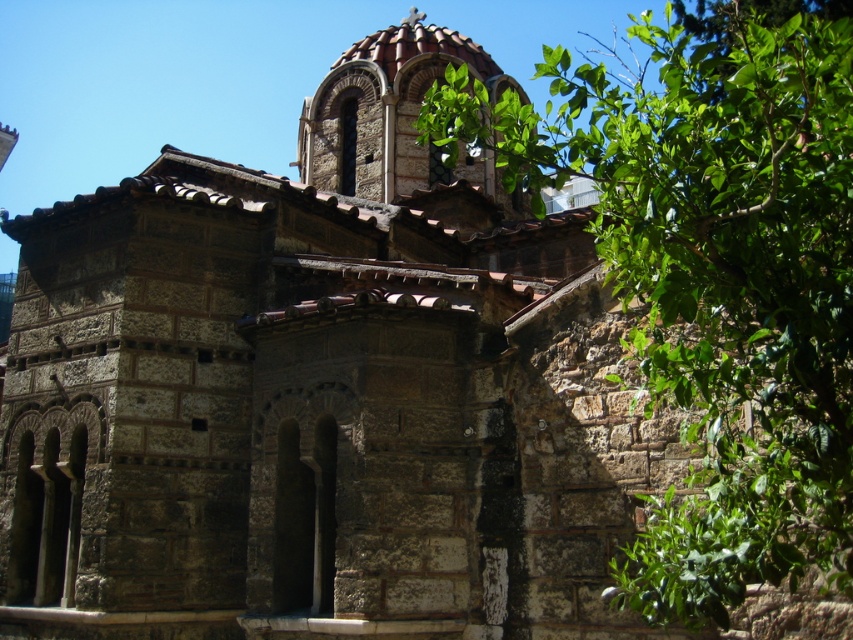
Can you confirm if green leafy tree at upper right is thinner than brown stone dome at upper center?

In fact, green leafy tree at upper right might be wider than brown stone dome at upper center.

Can you confirm if green leafy tree at upper right is smaller than brown stone dome at upper center?

Actually, green leafy tree at upper right might be larger than brown stone dome at upper center.

This screenshot has height=640, width=853. Describe the element at coordinates (712, 276) in the screenshot. I see `green leafy tree at upper right` at that location.

Find the location of a particular element. This screenshot has width=853, height=640. green leafy tree at upper right is located at coordinates (712, 276).